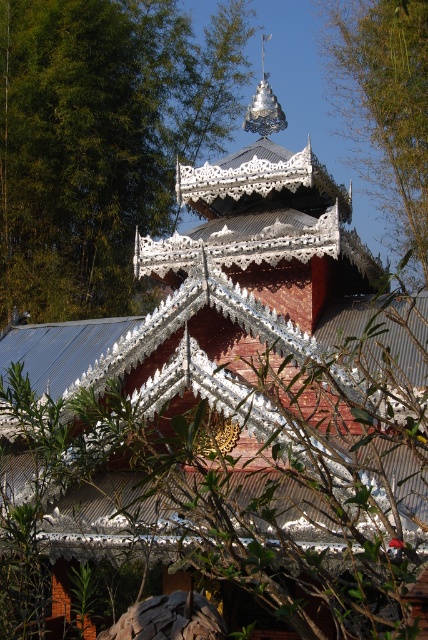
Question: Which point appears closest to the camera in this image?

Choices:
 (A) (362, 70)
 (B) (65, 317)

Answer: (B)

Question: Observing the image, what is the correct spatial positioning of green leafy tree at upper left in reference to green leafy tree at upper center?

Choices:
 (A) right
 (B) left

Answer: (B)

Question: Is green leafy tree at upper center above shiny silver spire at upper center?

Choices:
 (A) yes
 (B) no

Answer: (B)

Question: Considering the real-world distances, which object is farthest from the green leafy tree at upper center?

Choices:
 (A) green leafy tree at upper left
 (B) shiny silver spire at upper center

Answer: (A)

Question: Which of the following is the closest to the observer?

Choices:
 (A) shiny silver spire at upper center
 (B) green leafy tree at upper center

Answer: (A)

Question: Considering the relative positions of green leafy tree at upper left and green leafy tree at upper center in the image provided, where is green leafy tree at upper left located with respect to green leafy tree at upper center?

Choices:
 (A) above
 (B) below

Answer: (B)